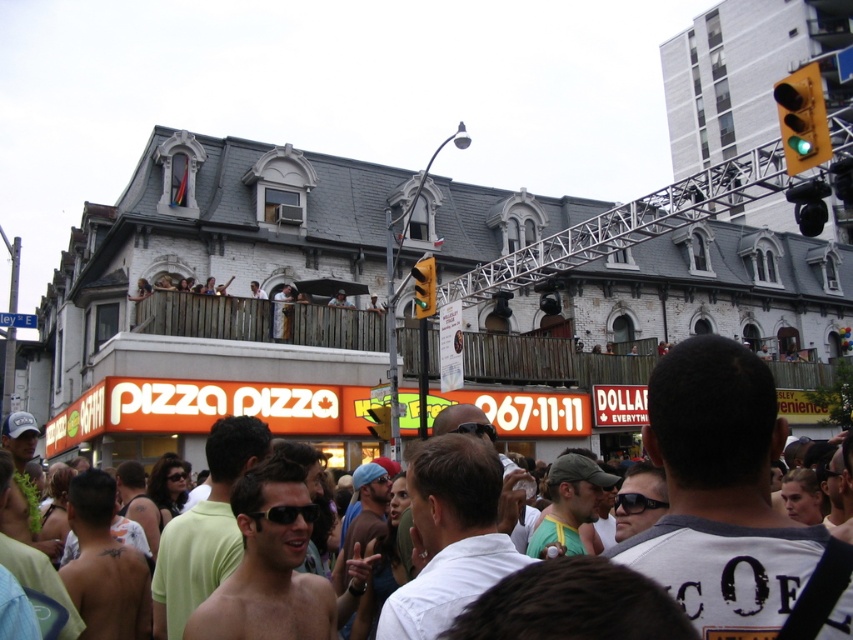
You are standing in the crowd at the urban event and notice two green items. One is the green fabric cap at center and the other is the green glass traffic light at upper right. Which of these two items is shorter?

The green fabric cap at center is shorter than the green glass traffic light at upper right.